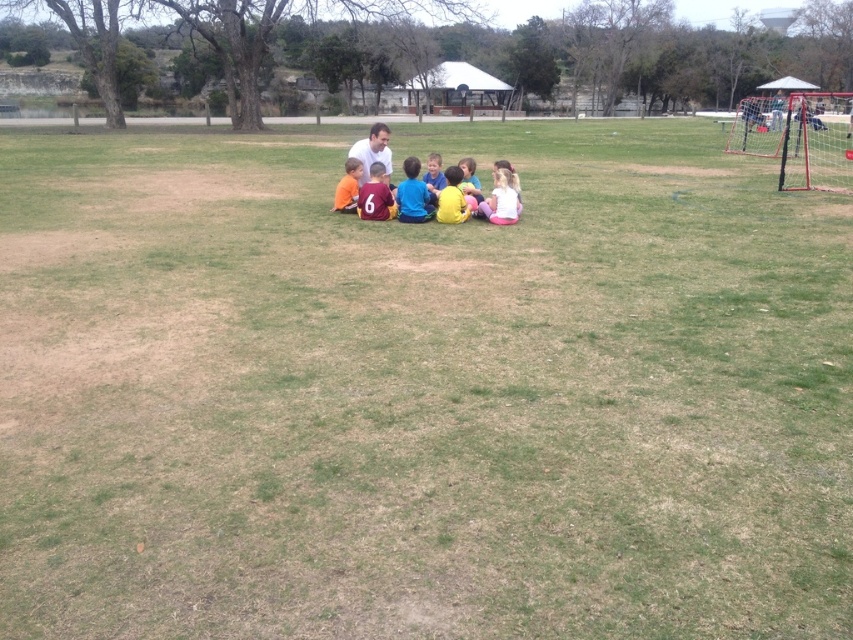
Question: Does orange jersey at center lie behind blue fabric shirt at center?

Choices:
 (A) no
 (B) yes

Answer: (A)

Question: Which is nearer to the white matte shirt at center?

Choices:
 (A) orange fabric shirt at center
 (B) matte pink shirt at center
 (C) orange jersey at center

Answer: (B)

Question: Is the position of matte blue shirt at center more distant than that of white matte shirt at center?

Choices:
 (A) yes
 (B) no

Answer: (A)

Question: From the image, what is the correct spatial relationship of matte blue shirt at center in relation to orange fabric shirt at center?

Choices:
 (A) above
 (B) below

Answer: (B)

Question: Which of the following is the closest to the observer?

Choices:
 (A) (404, 166)
 (B) (515, 214)

Answer: (B)

Question: Which object appears closest to the camera in this image?

Choices:
 (A) orange fabric shirt at center
 (B) yellow matte shirt at center
 (C) orange jersey at center
 (D) blue fabric shirt at center

Answer: (B)